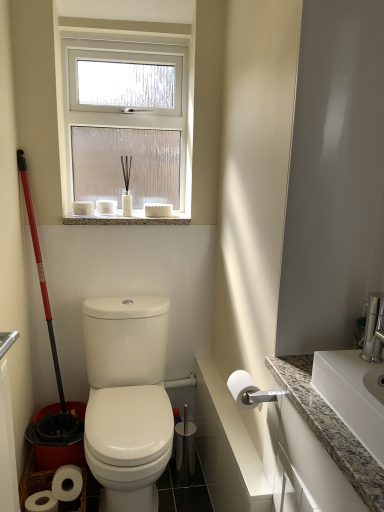
Where is `free space above clear glass window at upper center (from a real-world perspective)`? The width and height of the screenshot is (384, 512). free space above clear glass window at upper center (from a real-world perspective) is located at coordinates (133, 35).